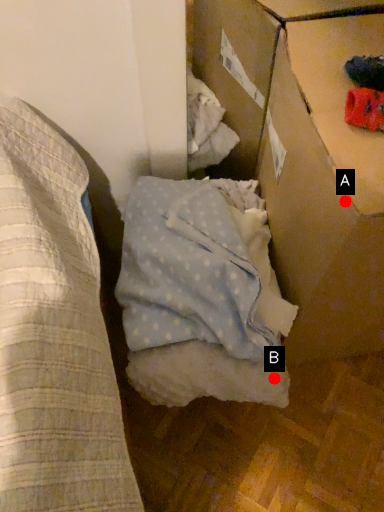
Question: Two points are circled on the image, labeled by A and B beside each circle. Among these points, which one is farthest from the camera?

Choices:
 (A) A is further
 (B) B is further

Answer: (B)